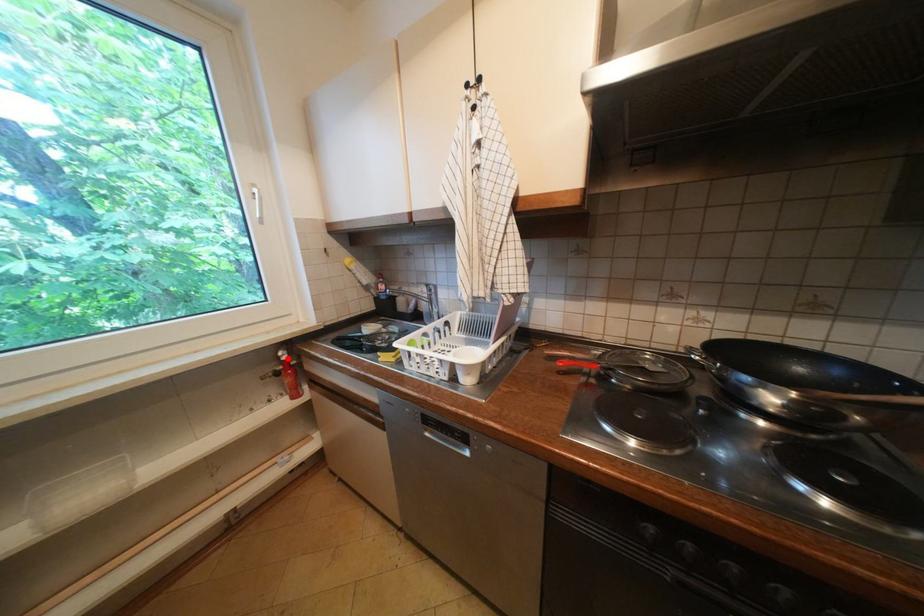
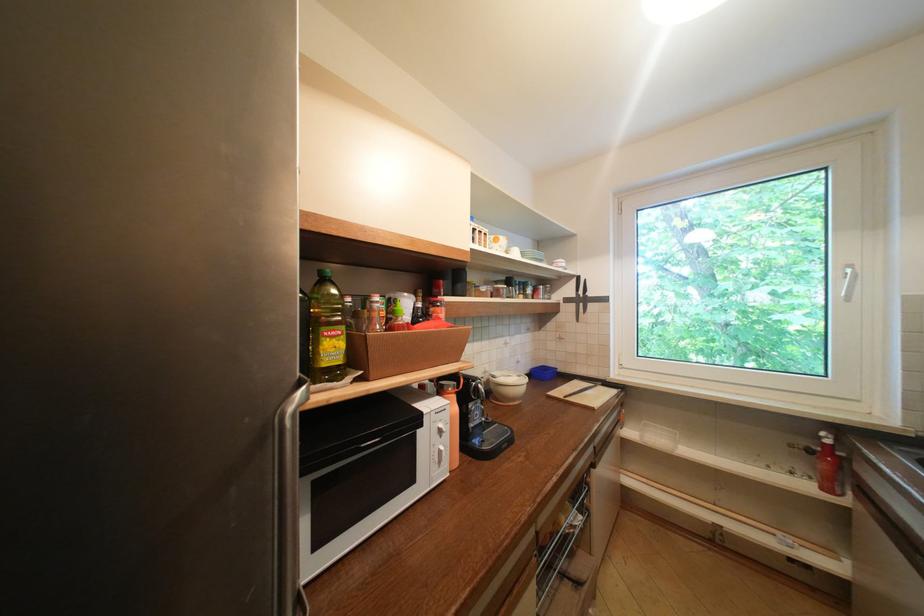
Locate, in the second image, the point that corresponds to the highlighted location in the first image.

(829, 439)